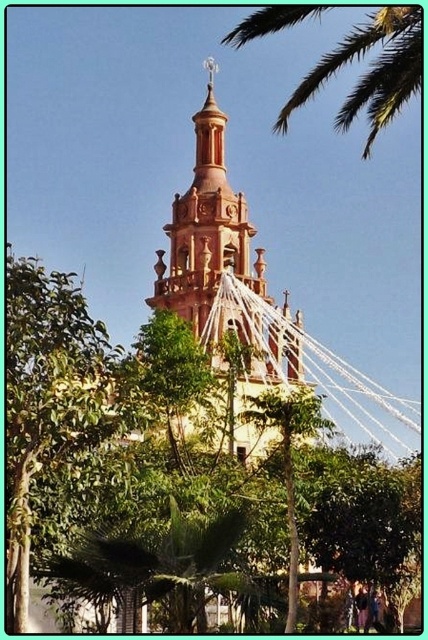
Identify the location of terracotta stucco church tower at center. The width and height of the screenshot is (428, 640). (208, 237).

Locate an element on the screen. Image resolution: width=428 pixels, height=640 pixels. terracotta stucco church tower at center is located at coordinates (208, 237).

Does green leafy palm at upper right have a lesser height compared to green leafy palm tree at center?

Incorrect, green leafy palm at upper right's height does not fall short of green leafy palm tree at center's.

Can you confirm if green leafy palm at upper right is positioned below green leafy palm tree at center?

Actually, green leafy palm at upper right is above green leafy palm tree at center.

This screenshot has width=428, height=640. What are the coordinates of `green leafy palm at upper right` in the screenshot? It's located at (369, 70).

What are the coordinates of `green leafy palm at upper right` in the screenshot? It's located at (369, 70).

Is terracotta stucco church tower at center above green leafy palm tree at center?

Yes.

Who is more forward, (229, 248) or (259, 428)?

Positioned in front is point (259, 428).

Image resolution: width=428 pixels, height=640 pixels. Identify the location of terracotta stucco church tower at center. (208, 237).